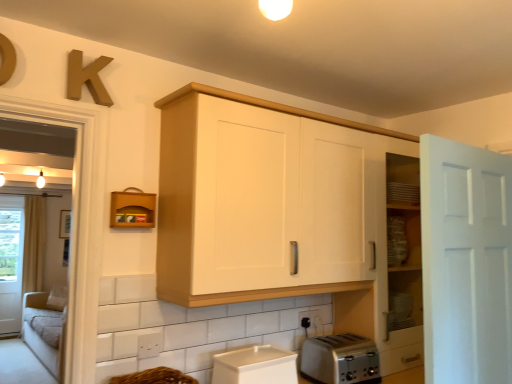
Question: Is white matte door at right positioned before black plastic electric outlet at lower center?

Choices:
 (A) no
 (B) yes

Answer: (B)

Question: From a real-world perspective, is white matte door at right over black plastic electric outlet at lower center?

Choices:
 (A) no
 (B) yes

Answer: (B)

Question: Does white matte door at right turn towards black plastic electric outlet at lower center?

Choices:
 (A) yes
 (B) no

Answer: (B)

Question: From a real-world perspective, is white matte door at right below black plastic electric outlet at lower center?

Choices:
 (A) yes
 (B) no

Answer: (B)

Question: Can you confirm if white matte door at right is thinner than black plastic electric outlet at lower center?

Choices:
 (A) yes
 (B) no

Answer: (B)

Question: Choose the correct answer: Is beige fabric screen door at left inside white wood cabinet at upper center or outside it?

Choices:
 (A) outside
 (B) inside

Answer: (A)

Question: In terms of width, does beige fabric screen door at left look wider or thinner when compared to white wood cabinet at upper center?

Choices:
 (A) wide
 (B) thin

Answer: (B)

Question: Is beige fabric screen door at left bigger or smaller than white wood cabinet at upper center?

Choices:
 (A) big
 (B) small

Answer: (A)

Question: From a real-world perspective, is beige fabric screen door at left physically located above or below white wood cabinet at upper center?

Choices:
 (A) below
 (B) above

Answer: (A)

Question: Is brown woven basket at lower center wider or thinner than brown leather shelf at upper left?

Choices:
 (A) thin
 (B) wide

Answer: (B)

Question: Is brown woven basket at lower center bigger or smaller than brown leather shelf at upper left?

Choices:
 (A) big
 (B) small

Answer: (A)

Question: From a real-world perspective, is brown woven basket at lower center positioned above or below brown leather shelf at upper left?

Choices:
 (A) below
 (B) above

Answer: (A)

Question: Considering the positions of point (162, 382) and point (135, 220), is point (162, 382) closer or farther from the camera than point (135, 220)?

Choices:
 (A) farther
 (B) closer

Answer: (A)

Question: Is point (227, 354) positioned closer to the camera than point (71, 92)?

Choices:
 (A) farther
 (B) closer

Answer: (A)

Question: From a real-world perspective, is white plastic container at lower center above or below wooden letter k at upper left?

Choices:
 (A) above
 (B) below

Answer: (B)